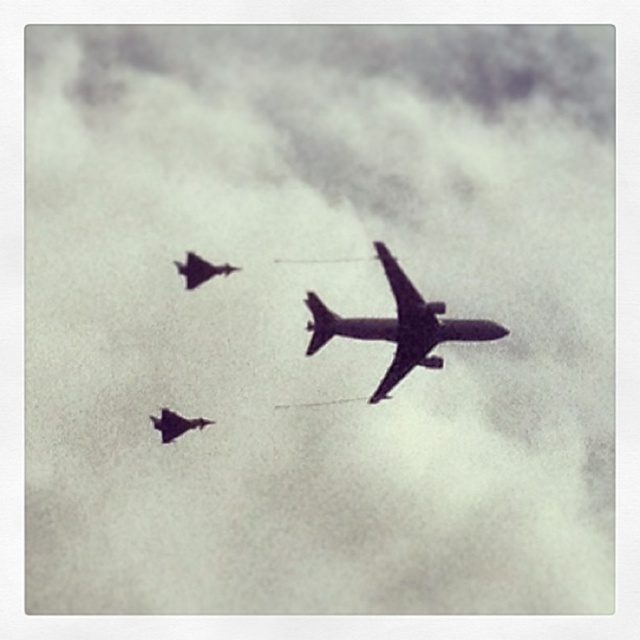
You are a pilot observing the formation of the shiny metallic airplane at center and the shiny dark gray jet at left. Which aircraft has a greater height?

The shiny metallic airplane at center is much taller than the shiny dark gray jet at left, so the shiny metallic airplane at center has a greater height.

Looking at this image, you are a pilot observing the formation of the shiny dark gray jet at left and the shiny dark gray jet at lower left. Which aircraft is larger in size?

The shiny dark gray jet at left is bigger than the shiny dark gray jet at lower left.